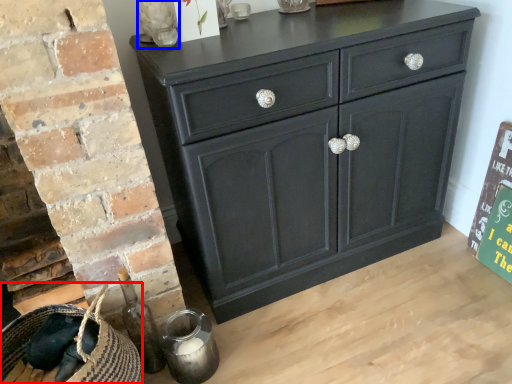
Question: Which object is further to the camera taking this photo, basket (highlighted by a red box) or glass vase (highlighted by a blue box)?

Choices:
 (A) basket
 (B) glass vase

Answer: (B)